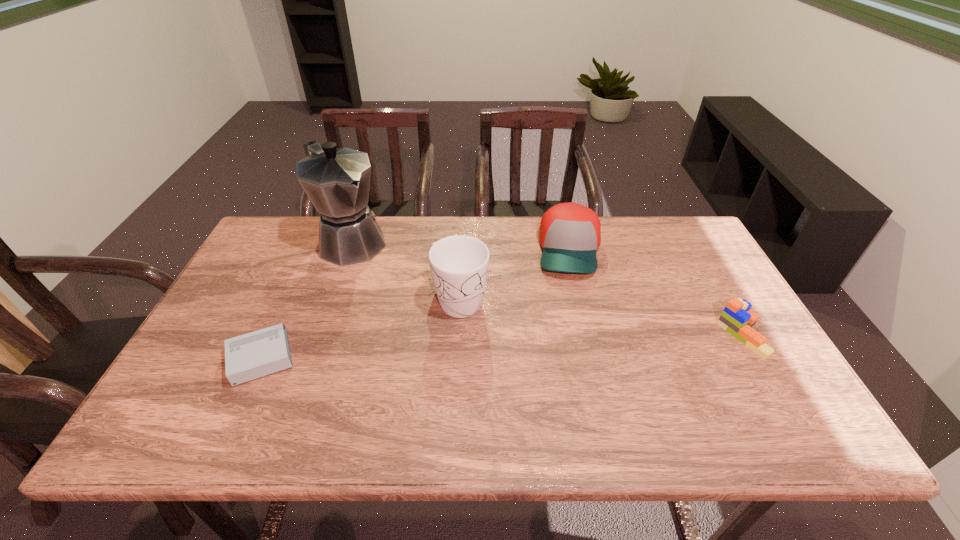
Find the location of a particular element. The image size is (960, 540). free space at the near left corner of the desktop is located at coordinates (228, 399).

Locate an element on the screen. This screenshot has width=960, height=540. vacant space at the far right corner of the desktop is located at coordinates tap(675, 217).

Identify the location of empty space that is in between the tallest object and the fourth tallest object. This screenshot has width=960, height=540. (546, 288).

Image resolution: width=960 pixels, height=540 pixels. I want to click on vacant space in between the fourth tallest object and the fourth shortest object, so click(x=601, y=317).

This screenshot has height=540, width=960. Find the location of `free space that is in between the second shortest object and the mug`. free space that is in between the second shortest object and the mug is located at coordinates (601, 317).

You are a GUI agent. You are given a task and a screenshot of the screen. Output one action in this format:
    pyautogui.click(x=<x>, y=<y>)
    Task: Click on the free space between the third object from left to right and the alarm clock
    The height and width of the screenshot is (540, 960).
    Given the screenshot: What is the action you would take?
    pyautogui.click(x=361, y=328)

This screenshot has width=960, height=540. What are the coordinates of `free space that is in between the Lego and the mug` in the screenshot? It's located at (601, 317).

Identify the location of vacant space that is in between the shortest object and the coffeepot. (306, 299).

You are a GUI agent. You are given a task and a screenshot of the screen. Output one action in this format:
    pyautogui.click(x=<x>, y=<y>)
    Task: Click on the free space between the alarm clock and the fourth shortest object
    This screenshot has width=960, height=540.
    Given the screenshot: What is the action you would take?
    pyautogui.click(x=361, y=328)

I want to click on blank region between the alarm clock and the Lego, so click(x=501, y=346).